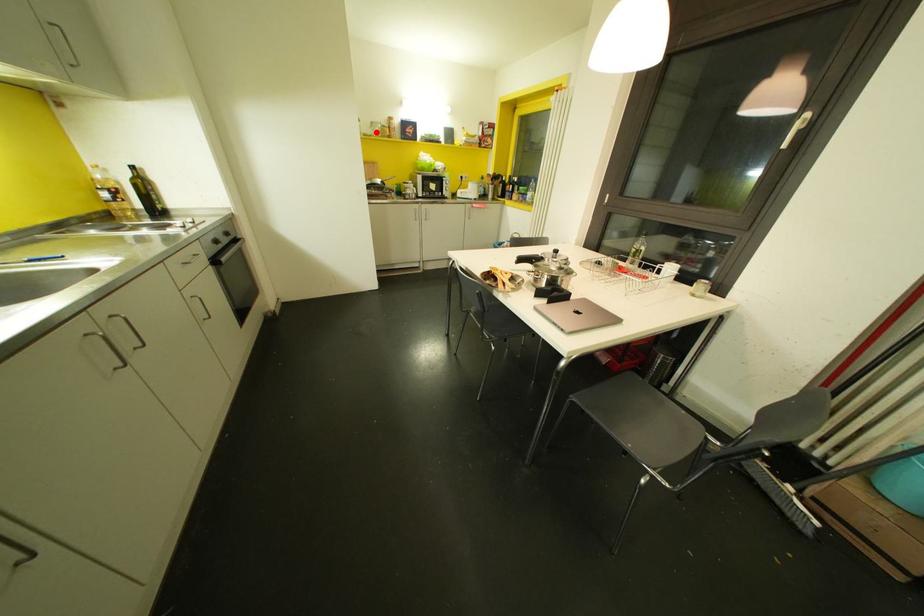
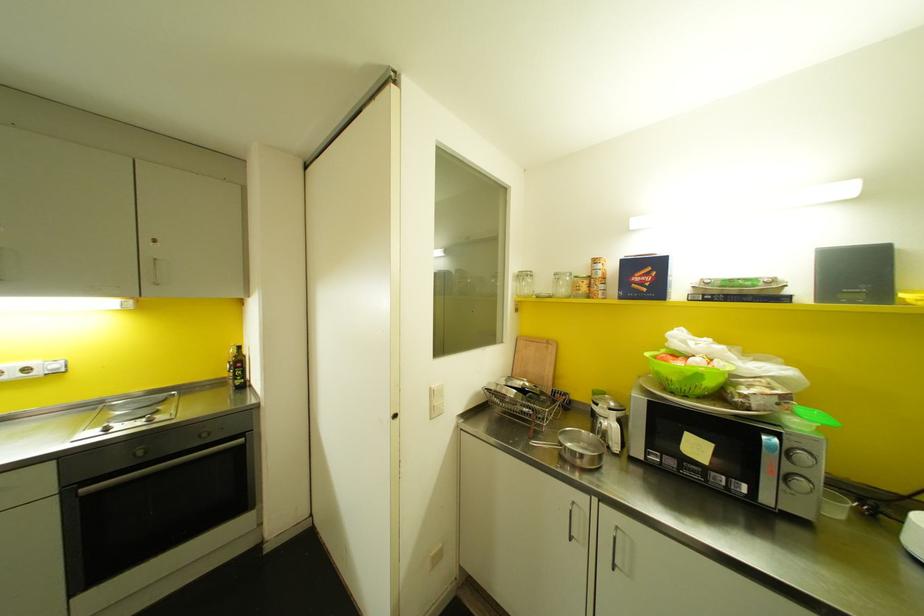
Locate, in the second image, the point that corresponds to the highlighted location in the first image.

(562, 290)